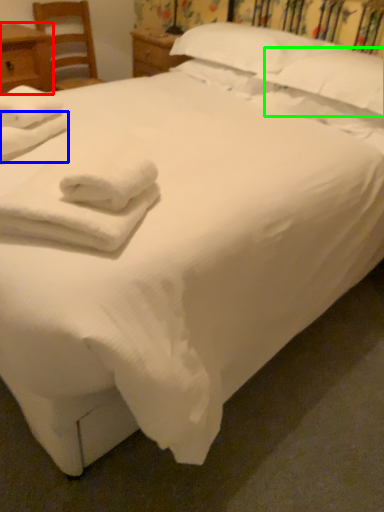
Question: Estimate the real-world distances between objects in this image. Which object is farther from nightstand (highlighted by a red box), bath towel (highlighted by a blue box) or pillow (highlighted by a green box)?

Choices:
 (A) bath towel
 (B) pillow

Answer: (B)